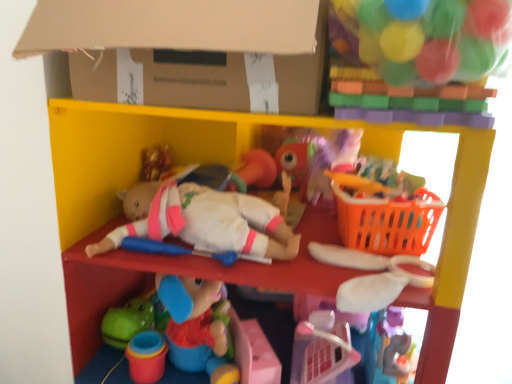
Question: From a real-world perspective, is smooth plastic shelf at center above or below cardboard at upper center?

Choices:
 (A) below
 (B) above

Answer: (A)

Question: Based on their positions, is smooth plastic shelf at center located to the left or right of cardboard at upper center?

Choices:
 (A) left
 (B) right

Answer: (B)

Question: Which object is the farthest from the orange plastic basket at right?

Choices:
 (A) smooth plastic shelf at center
 (B) white fabric bow at upper right, acting as the 2th toy starting from the top
 (C) translucent plastic balls at upper right, placed as the 1th toy when sorted from top to bottom
 (D) cardboard at upper center

Answer: (D)

Question: Estimate the real-world distances between objects in this image. Which object is farther from the translucent plastic balls at upper right, placed as the 1th toy when sorted from top to bottom?

Choices:
 (A) smooth plastic shelf at center
 (B) cardboard at upper center
 (C) orange plastic basket at right
 (D) white fabric bow at upper right, the 1th toy in the bottom-to-top sequence

Answer: (D)